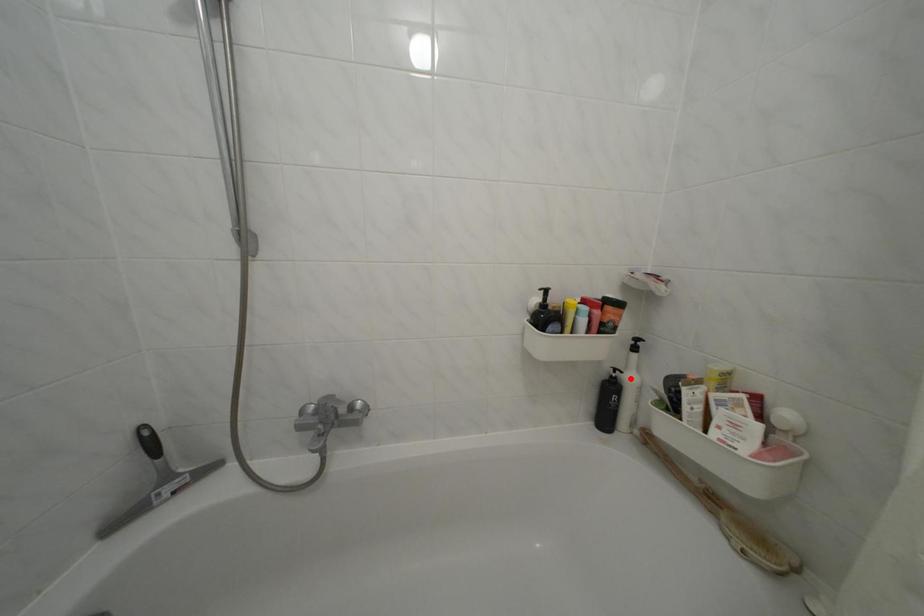
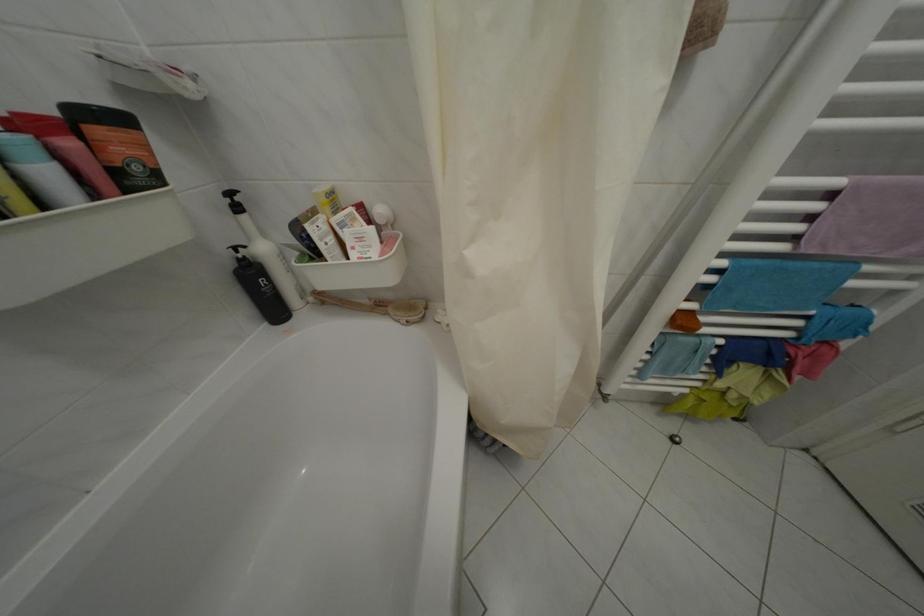
Locate, in the second image, the point that corresponds to the highlighted location in the first image.

(253, 254)